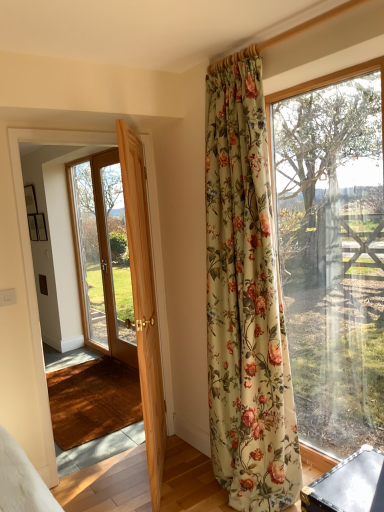
Locate an element on the screen. This screenshot has height=512, width=384. wooden barn door at left is located at coordinates (126, 223).

What is the approximate width of clear glass door at left?

clear glass door at left is 6.02 inches wide.

Describe the element at coordinates (103, 254) in the screenshot. The height and width of the screenshot is (512, 384). I see `clear glass door at left` at that location.

Describe the element at coordinates (333, 251) in the screenshot. This screenshot has width=384, height=512. I see `transparent glass window at right` at that location.

The width and height of the screenshot is (384, 512). What are the coordinates of `light wood door at left` in the screenshot? It's located at (144, 303).

Image resolution: width=384 pixels, height=512 pixels. Find the location of `wooden barn door at left`. wooden barn door at left is located at coordinates (126, 223).

Does clear glass door at left turn towards floral fabric curtain at upper right?

No, clear glass door at left is not facing towards floral fabric curtain at upper right.

Is point (113, 253) behind point (210, 108)?

Yes, point (113, 253) is behind point (210, 108).

Measure the distance between clear glass door at left and floral fabric curtain at upper right.

clear glass door at left and floral fabric curtain at upper right are 2.31 meters apart from each other.

From a real-world perspective, is clear glass door at left physically below floral fabric curtain at upper right?

Correct, in the physical world, clear glass door at left is lower than floral fabric curtain at upper right.

The width and height of the screenshot is (384, 512). Identify the location of curtain above the light wood door at left (from the image's perspective). (245, 298).

Consider the image. Is floral fabric curtain at upper right inside light wood door at left?

No.

Does light wood door at left turn towards floral fabric curtain at upper right?

Yes, light wood door at left is facing floral fabric curtain at upper right.

Visually, is light wood door at left positioned to the left or to the right of floral fabric curtain at upper right?

light wood door at left is to the left of floral fabric curtain at upper right.

From a real-world perspective, is wooden barn door at left on light wood door at left?

Yes.

From the image's perspective, is wooden barn door at left above or below light wood door at left?

wooden barn door at left is above light wood door at left.

Can you tell me how much wooden barn door at left and light wood door at left differ in facing direction?

130 degrees separate the facing orientations of wooden barn door at left and light wood door at left.

Between wooden barn door at left and light wood door at left, which one has less height?

light wood door at left is shorter.

From a real-world perspective, does floral fabric curtain at upper right sit lower than transparent glass window at right?

No, from a real-world perspective, floral fabric curtain at upper right is not beneath transparent glass window at right.

Does floral fabric curtain at upper right have a lesser width compared to transparent glass window at right?

Incorrect, the width of floral fabric curtain at upper right is not less than that of transparent glass window at right.

Is floral fabric curtain at upper right further to camera compared to transparent glass window at right?

No, the depth of floral fabric curtain at upper right is less than that of transparent glass window at right.

Identify the location of curtain above the transparent glass window at right (from a real-world perspective). (245, 298).

In terms of height, does transparent glass window at right look taller or shorter compared to floral fabric curtain at upper right?

Clearly, transparent glass window at right is shorter compared to floral fabric curtain at upper right.

Looking at this image, does transparent glass window at right have a larger size compared to floral fabric curtain at upper right?

Actually, transparent glass window at right might be smaller than floral fabric curtain at upper right.

From the image's perspective, is transparent glass window at right under floral fabric curtain at upper right?

Indeed, from the image's perspective, transparent glass window at right is shown beneath floral fabric curtain at upper right.

Is point (343, 111) positioned behind point (28, 310)?

That is True.

Looking at this image, how distant is transparent glass window at right from wooden barn door at left?

transparent glass window at right is 1.14 meters away from wooden barn door at left.

From a real-world perspective, which object rests below the other?

wooden barn door at left.

Which is more to the left, transparent glass window at right or wooden barn door at left?

wooden barn door at left.

Is point (146, 412) behind point (135, 247)?

No, it is not.

Where is `barn door above the light wood door at left (from a real-world perspective)`? Image resolution: width=384 pixels, height=512 pixels. barn door above the light wood door at left (from a real-world perspective) is located at coordinates (126, 223).

Can you confirm if light wood door at left is bigger than wooden barn door at left?

Indeed, light wood door at left has a larger size compared to wooden barn door at left.

Which object is positioned more to the right, light wood door at left or wooden barn door at left?

light wood door at left is more to the right.

Find the location of a particular element. curtain that appears below the clear glass door at left (from the image's perspective) is located at coordinates (245, 298).

The height and width of the screenshot is (512, 384). Identify the location of curtain that appears in front of the light wood door at left. (245, 298).

Considering their positions, is transparent glass window at right positioned closer to light wood door at left than wooden barn door at left?

The object closer to light wood door at left is wooden barn door at left.

Based on their spatial positions, is light wood door at left or clear glass door at left further from wooden barn door at left?

clear glass door at left.

Estimate the real-world distances between objects in this image. Which object is further from transparent glass window at right, light wood door at left or wooden barn door at left?

light wood door at left lies further to transparent glass window at right than the other object.

Consider the image. From the image, which object appears to be nearer to clear glass door at left, light wood door at left or floral fabric curtain at upper right?

light wood door at left lies closer to clear glass door at left than the other object.

Looking at the image, which one is located closer to wooden barn door at left, clear glass door at left or transparent glass window at right?

transparent glass window at right is closer to wooden barn door at left.

Estimate the real-world distances between objects in this image. Which object is closer to light wood door at left, wooden barn door at left or transparent glass window at right?

wooden barn door at left is positioned closer to the anchor light wood door at left.

Which object lies nearer to the anchor point transparent glass window at right, light wood door at left or floral fabric curtain at upper right?

The object closer to transparent glass window at right is floral fabric curtain at upper right.

Considering their positions, is wooden barn door at left positioned closer to clear glass door at left than light wood door at left?

wooden barn door at left is closer to clear glass door at left.

Find the location of `door between floral fabric curtain at upper right and clear glass door at left in the front-back direction`. door between floral fabric curtain at upper right and clear glass door at left in the front-back direction is located at coordinates (144, 303).

Where is `barn door between light wood door at left and clear glass door at left along the z-axis`? barn door between light wood door at left and clear glass door at left along the z-axis is located at coordinates (126, 223).

Find the location of a particular element. This screenshot has height=512, width=384. window positioned between floral fabric curtain at upper right and clear glass door at left from near to far is located at coordinates (333, 251).

The image size is (384, 512). What are the coordinates of `door located between wooden barn door at left and floral fabric curtain at upper right in the left-right direction` in the screenshot? It's located at (144, 303).